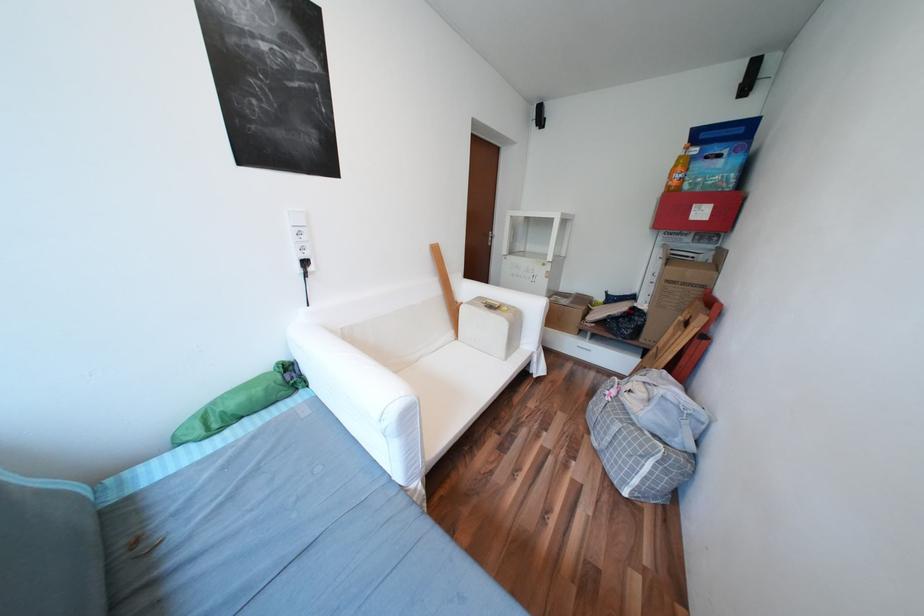
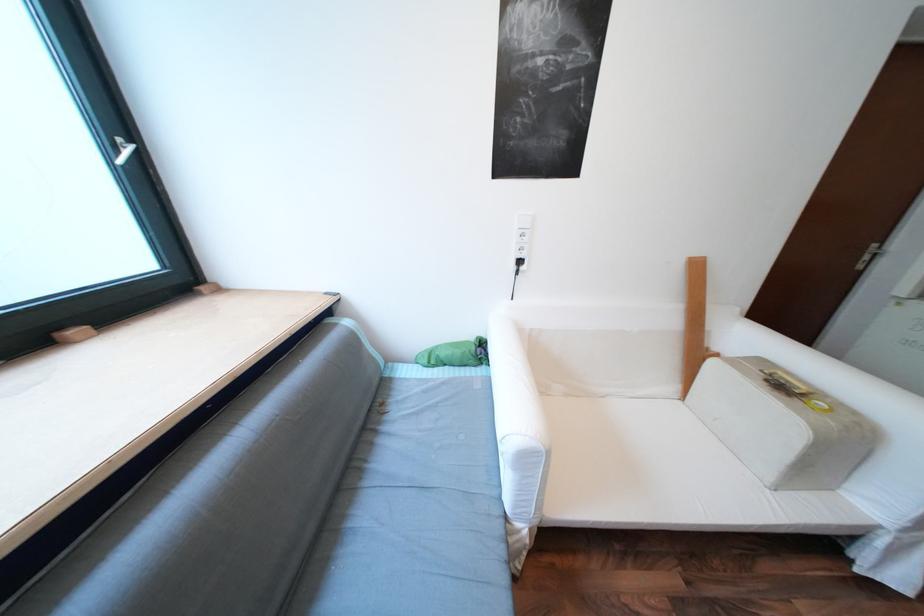
The point at (507, 307) is marked in the first image. Where is the corresponding point in the second image?

(811, 394)